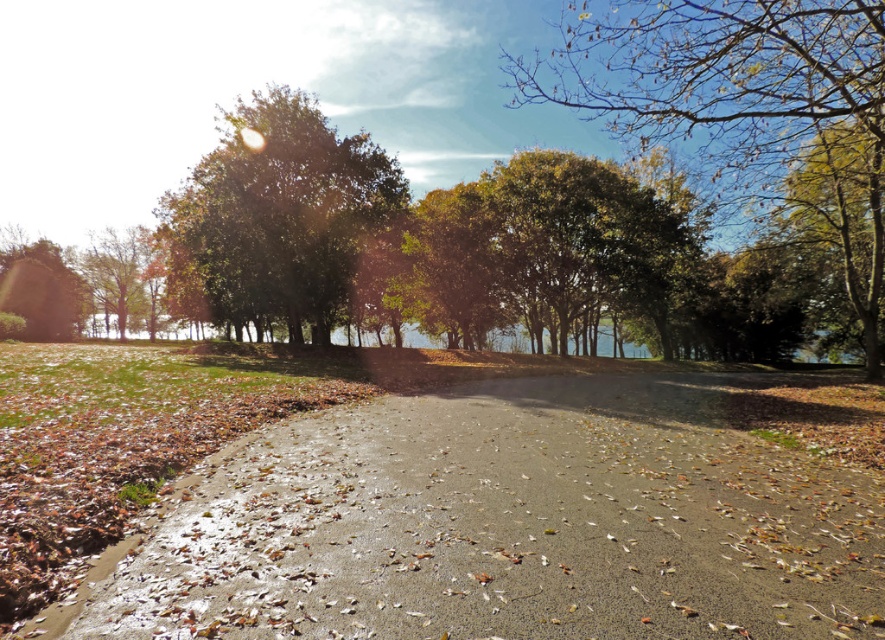
You are standing at the start of the pathway in the foreground and want to take a photo of the green leafy tree at upper center. Given that your camera has a maximum focus range of 8 meters, will you be able to capture the tree clearly?

The green leafy tree at upper center is 8.33 meters away from the camera, which exceeds the maximum focus range of 8 meters. Therefore, you won

You are standing on the paved pathway in the foreground and want to take a photo of both the green leafy tree at upper left and the green matte tree at lower left. Which tree will appear larger in the photo due to its height?

The green leafy tree at upper left will appear larger in the photo because it is taller than the green matte tree at lower left.

You are an artist setting up your easel to paint the scene. You want to capture both the green leafy tree at upper left and the green matte tree at lower left in your painting. Which tree should you focus on first if you want to paint the larger one first?

The green leafy tree at upper left is bigger than the green matte tree at lower left, so you should focus on painting the green leafy tree at upper left first.